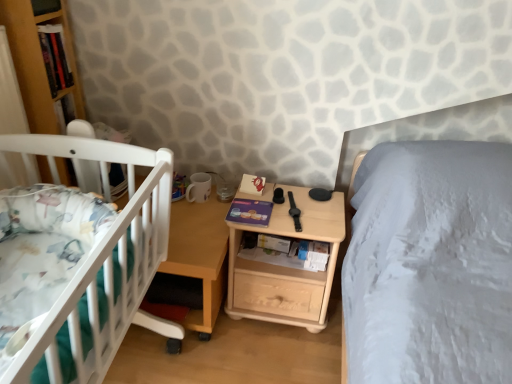
Question: Which is correct: white plastic crib at left is inside matte purple book at center, which appears as the second book when viewed from the left, or outside of it?

Choices:
 (A) inside
 (B) outside

Answer: (B)

Question: Does point (x=90, y=253) appear closer or farther from the camera than point (x=251, y=218)?

Choices:
 (A) closer
 (B) farther

Answer: (A)

Question: Which of these objects is positioned closest to the hardcover book at upper left, the first book positioned from the top?

Choices:
 (A) wooden table at center
 (B) natural wood nightstand at center
 (C) white plastic crib at left
 (D) matte purple book at center, arranged as the second book when viewed from the top

Answer: (C)

Question: Which is nearer to the hardcover book at upper left, the 1th book positioned from the left?

Choices:
 (A) natural wood nightstand at center
 (B) wooden table at center
 (C) matte purple book at center, the 1th book in the bottom-to-top sequence
 (D) white plastic crib at left

Answer: (D)